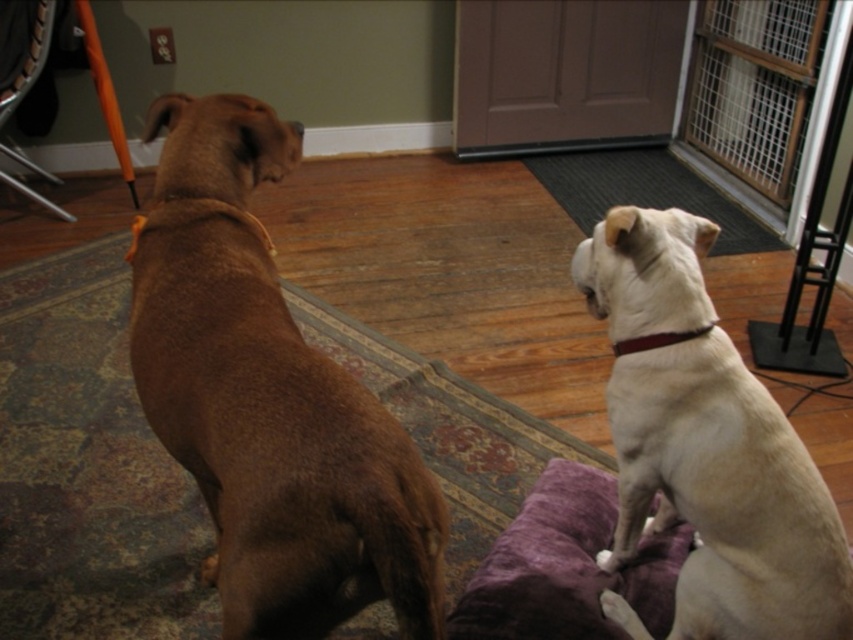
You are a delivery person holding a package that requires a 4 feet clearance to pass through the doorway. You notice the point at coordinates point at point (258,348). Can you safely navigate through the doorway with the package?

The distance between the two points is 3.64 feet, which is less than the required 4 feet clearance. Therefore, you cannot safely navigate through the doorway with the package.

Where is the brown fur dog at left located in the image?

The brown fur dog at left is located at point (268,397).